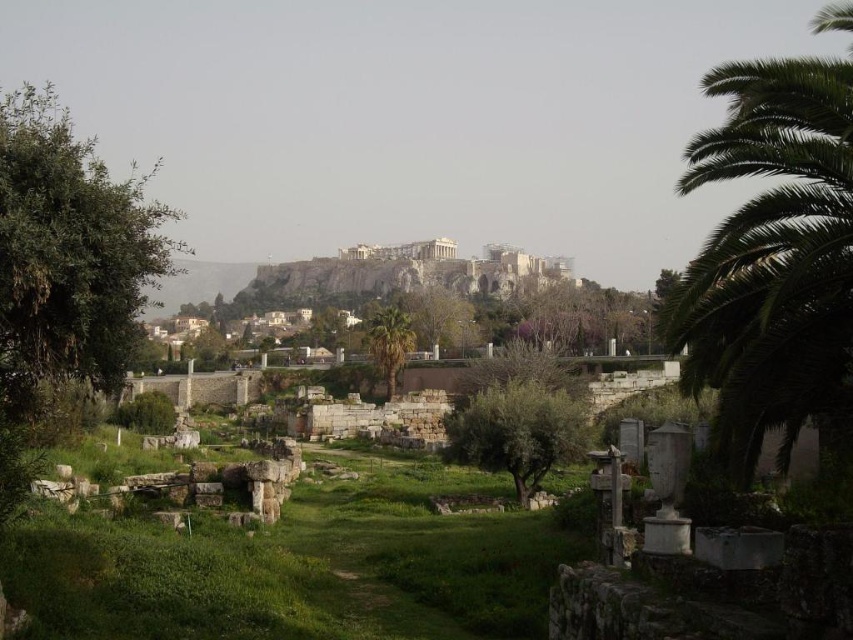
Question: Which point appears farthest from the camera in this image?

Choices:
 (A) (473, 563)
 (B) (579, 417)
 (C) (392, 396)

Answer: (C)

Question: Is green leafy tree at left smaller than green leafy tree at center?

Choices:
 (A) yes
 (B) no

Answer: (B)

Question: Among these points, which one is farthest from the camera?

Choices:
 (A) (782, 353)
 (B) (28, 195)

Answer: (A)

Question: Which of the following is the closest to the observer?

Choices:
 (A) green leafy palm at right
 (B) green grass at center
 (C) green leafy tree at center

Answer: (B)

Question: From the image, what is the correct spatial relationship of green grass at center in relation to green leafy tree at left?

Choices:
 (A) below
 (B) above

Answer: (A)

Question: Does green leafy palm at right appear over green leafy tree at center?

Choices:
 (A) no
 (B) yes

Answer: (B)